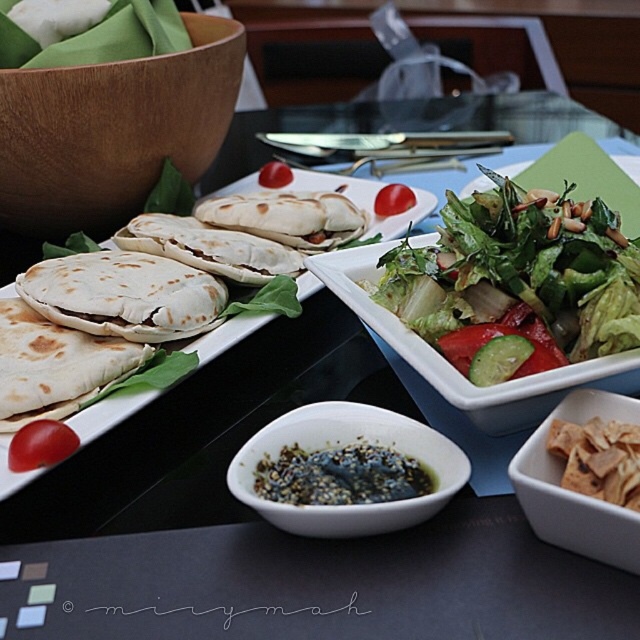
Question: Where is white soft tortilla at center-left located in relation to white soft pita bread at left in the image?

Choices:
 (A) right
 (B) left

Answer: (B)

Question: Which point is closer to the camera taking this photo?

Choices:
 (A) coord(60,180)
 (B) coord(433,509)

Answer: (B)

Question: Which object is farther from the camera taking this photo?

Choices:
 (A) semi-liquid dark green at center
 (B) white soft tortilla at center-left
 (C) red smooth tomato at center
 (D) white soft tortilla at left

Answer: (C)

Question: Does white soft tortilla at left have a lesser width compared to white soft pita bread at left?

Choices:
 (A) no
 (B) yes

Answer: (B)

Question: Can you confirm if wooden bowl at upper left is positioned below semi-liquid dark green at center?

Choices:
 (A) yes
 (B) no

Answer: (B)

Question: Which point appears closest to the camera in this image?

Choices:
 (A) (68, 208)
 (B) (301, 433)
 (C) (19, 381)

Answer: (B)